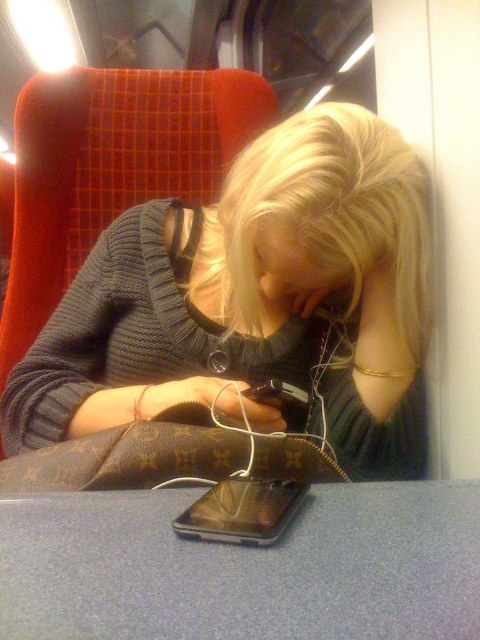
You are a passenger on a train and you see the knitted sweater at center and the shiny metallic phone at center. Which object is closer to you?

The knitted sweater at center is closer to you because the shiny metallic phone at center is behind it.

You are a passenger on a train and you see a knitted sweater at center and a shiny metallic phone at center. Which object is closer to the ceiling?

The knitted sweater at center is located above the shiny metallic phone at center, so it is closer to the ceiling.

You are sitting in the train carriage and want to reach both the point at (123,358) and the point at (231,515). Which point is closer to you?

The point at (123,358) is closer to you because it is further to the viewer than the point at (231,515).